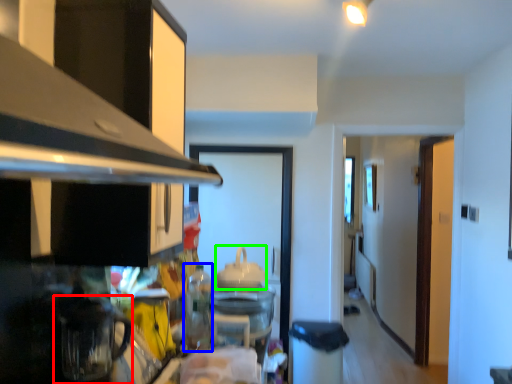
Question: Which object is positioned closest to appliance (highlighted by a red box)? Select from appliance (highlighted by a blue box) and appliance (highlighted by a green box).

Choices:
 (A) appliance
 (B) appliance

Answer: (A)